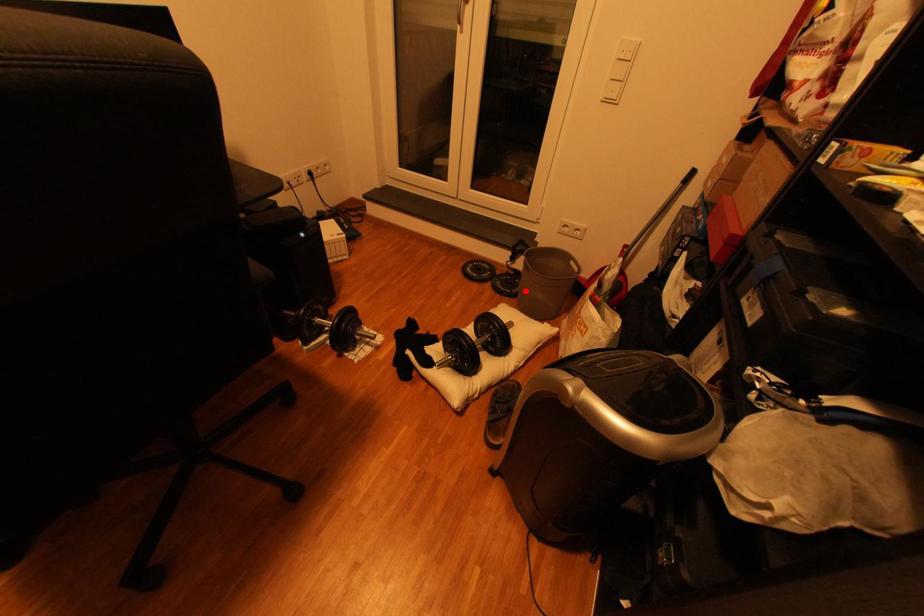
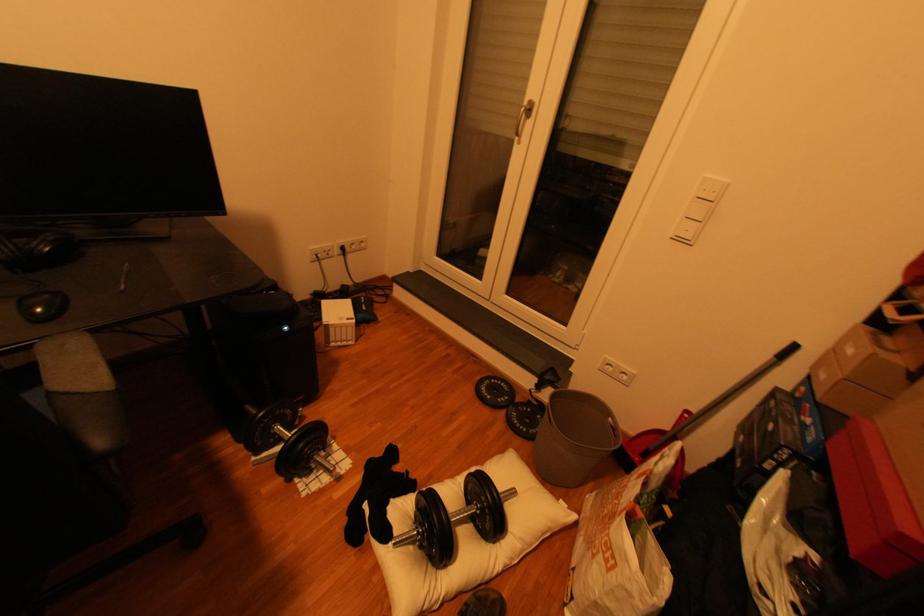
Question: I am providing you with two images of the same scene from different viewpoints. Image1 has a red point marked. In image2, the corresponding 3D location appears at what relative position? Reply with the corresponding letter.

Choices:
 (A) Closer
 (B) Farther

Answer: (A)